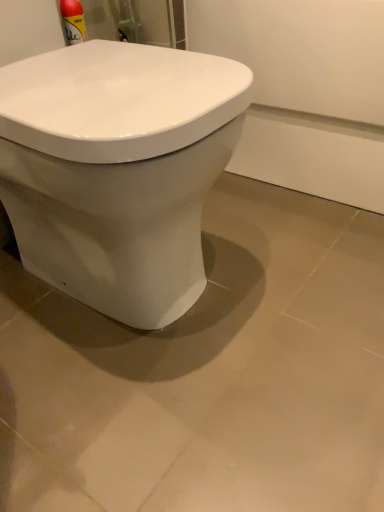
Question: From a real-world perspective, is white glossy toilet at center above or below matte white ceramic tile at center?

Choices:
 (A) below
 (B) above

Answer: (B)

Question: Does point (150, 219) appear closer or farther from the camera than point (92, 443)?

Choices:
 (A) farther
 (B) closer

Answer: (B)

Question: In the image, is white glossy toilet at center on the left side or the right side of matte white ceramic tile at center?

Choices:
 (A) right
 (B) left

Answer: (B)

Question: From a real-world perspective, is matte white ceramic tile at center above or below white glossy toilet at center?

Choices:
 (A) below
 (B) above

Answer: (A)

Question: Is matte white ceramic tile at center wider or thinner than white glossy toilet at center?

Choices:
 (A) thin
 (B) wide

Answer: (B)

Question: Considering the positions of matte white ceramic tile at center and white glossy toilet at center in the image, is matte white ceramic tile at center taller or shorter than white glossy toilet at center?

Choices:
 (A) short
 (B) tall

Answer: (A)

Question: Looking at the image, does matte white ceramic tile at center seem bigger or smaller compared to white glossy toilet at center?

Choices:
 (A) big
 (B) small

Answer: (B)